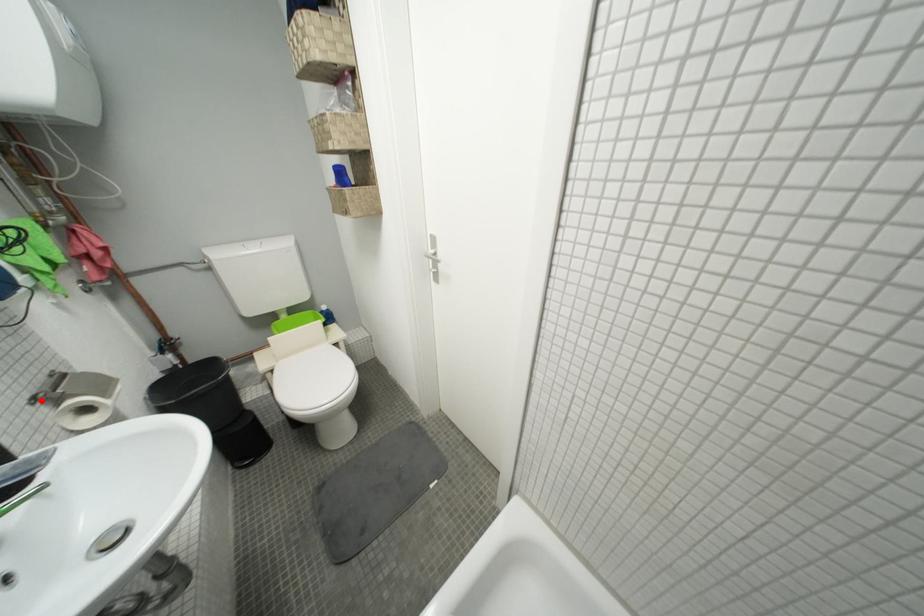
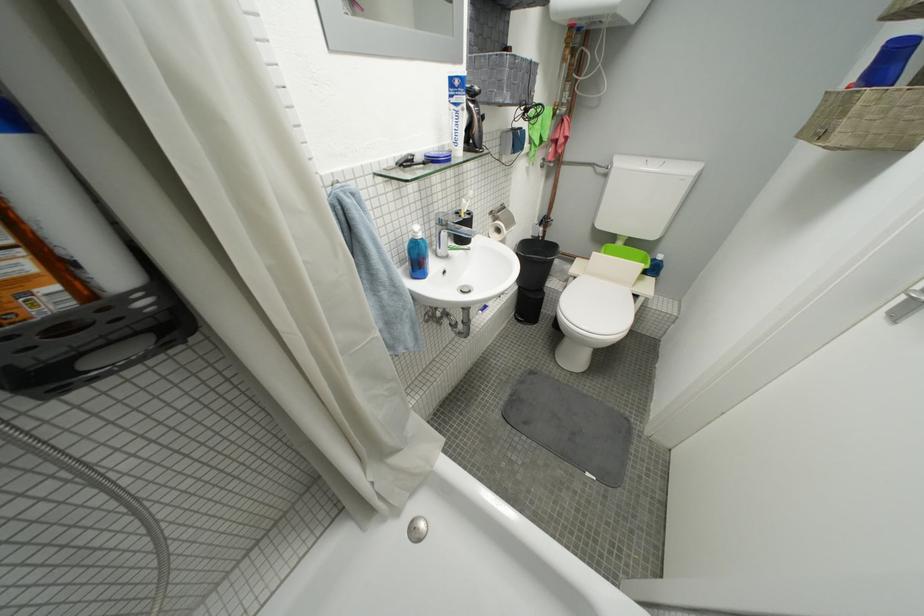
Question: A red point is marked in image1. In image2, is the corresponding 3D point closer to the camera or farther? Reply with the corresponding letter.

Choices:
 (A) The corresponding 3D point is closer.
 (B) The corresponding 3D point is farther.

Answer: (A)